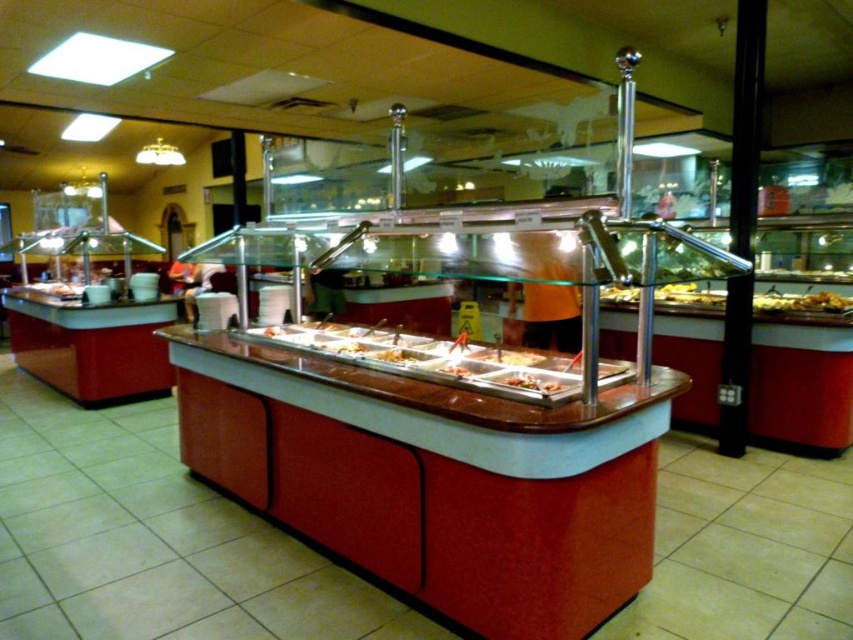
You are a customer at the buffet station and want to serve yourself. You notice two items at the center of the station. Which item is bigger between the white glossy food at center and the white glossy tray at center?

The white glossy food at center is larger in size compared to the white glossy tray at center.

You are a customer at the buffet station and want to reach both the point at coordinates point [514,380] and point [467,371]. Which point should you approach first to minimize the distance walked?

You should approach the point [514,380] first because it is closer to you than point [467,371], so reaching it first requires less walking distance.